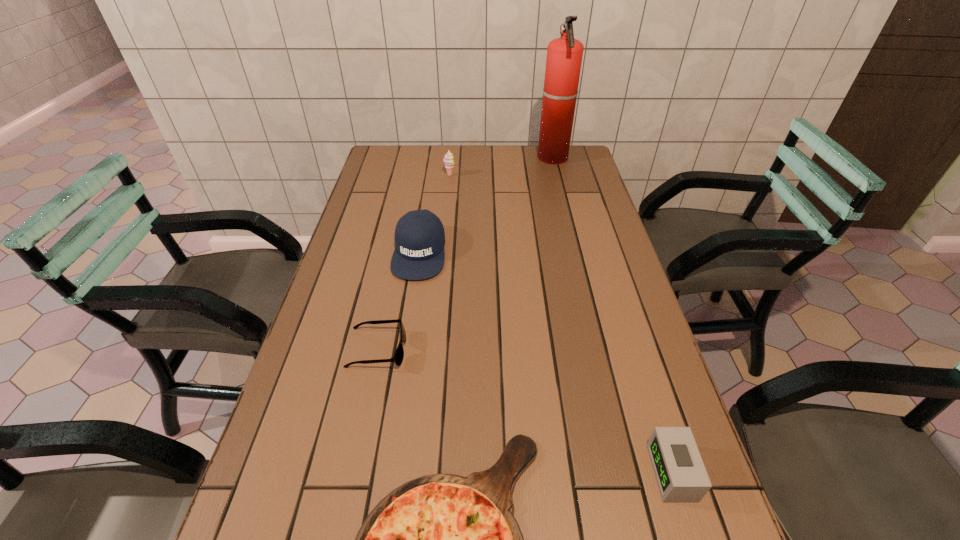
Locate an element on the screen. This screenshot has width=960, height=540. the farthest object is located at coordinates 564,55.

You are a GUI agent. You are given a task and a screenshot of the screen. Output one action in this format:
    pyautogui.click(x=<x>, y=<y>)
    Task: Click on the tallest object
    The image size is (960, 540).
    Given the screenshot: What is the action you would take?
    pyautogui.click(x=564, y=55)

Where is `the fourth nearest object`? the fourth nearest object is located at coordinates (419, 253).

At what (x,y) coordinates should I click in order to perform the action: click on the second farthest object. Please return your answer as a coordinate pair (x, y). The height and width of the screenshot is (540, 960). Looking at the image, I should click on (448, 160).

The image size is (960, 540). Find the location of `the third shortest object`. the third shortest object is located at coordinates (680, 473).

The image size is (960, 540). What are the coordinates of `the fourth farthest object` in the screenshot? It's located at (399, 354).

Find the location of a particular element. Image resolution: width=960 pixels, height=540 pixels. vacant space located 0.370m with the nozzle and gauge on the tallest object is located at coordinates (442, 158).

Where is `vacant space positioned with the nozzle and gauge on the tallest object`? This screenshot has height=540, width=960. vacant space positioned with the nozzle and gauge on the tallest object is located at coordinates (478, 158).

Find the location of a particular element. free space located 0.280m with the nozzle and gauge on the tallest object is located at coordinates (465, 158).

Identify the location of free space located on the front-facing side of the fourth nearest object. The width and height of the screenshot is (960, 540). (409, 321).